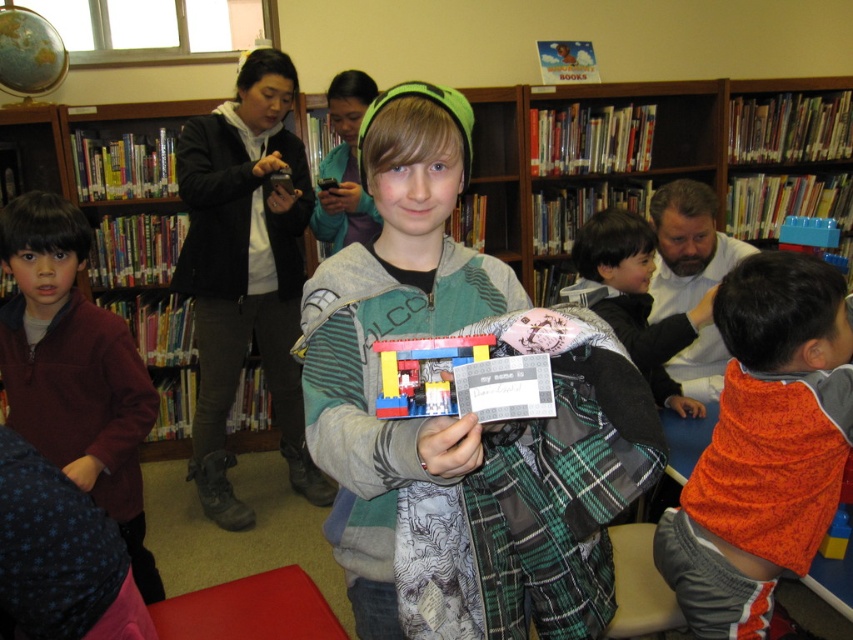
What is the position of the point with coordinates (431, 417) in the image?

The point with coordinates (431, 417) is located on the plaid fabric jacket at center.

You are a photographer trying to capture a clear shot of both the orange fleece sweater at center and the translucent plastic toy at center. Since you can only focus on one object at a time, which object should you focus on to ensure the other remains in the background?

You should focus on the orange fleece sweater at center because it is closer to you than the translucent plastic toy at center, so focusing on it will keep the translucent plastic toy at center in the background.

You are a fashion designer looking at the image and want to create a new line of clothing that incorporates elements from both the orange fleece sweater at center and the translucent plastic toy at center. Which item should be the base for the design if you want the base to be the taller object?

The orange fleece sweater at center is taller than the translucent plastic toy at center, so the base should be the orange fleece sweater at center.